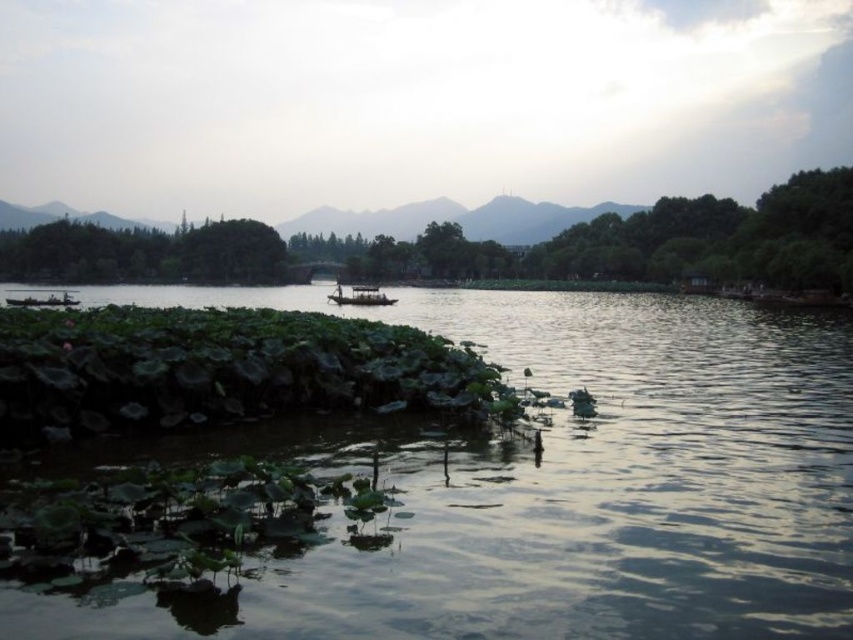
Question: Which point appears closest to the camera in this image?

Choices:
 (A) (463, 540)
 (B) (372, 300)
 (C) (67, 301)

Answer: (A)

Question: Considering the real-world distances, which object is farthest from the wooden boat at center?

Choices:
 (A) green leafy river at center
 (B) wooden boat at left

Answer: (A)

Question: Is wooden boat at center above wooden boat at left?

Choices:
 (A) no
 (B) yes

Answer: (B)

Question: Which of the following is the closest to the observer?

Choices:
 (A) wooden boat at left
 (B) green leafy river at center
 (C) wooden boat at center

Answer: (B)

Question: Can you confirm if wooden boat at center is thinner than wooden boat at left?

Choices:
 (A) no
 (B) yes

Answer: (B)

Question: Does wooden boat at center have a greater width compared to wooden boat at left?

Choices:
 (A) no
 (B) yes

Answer: (A)